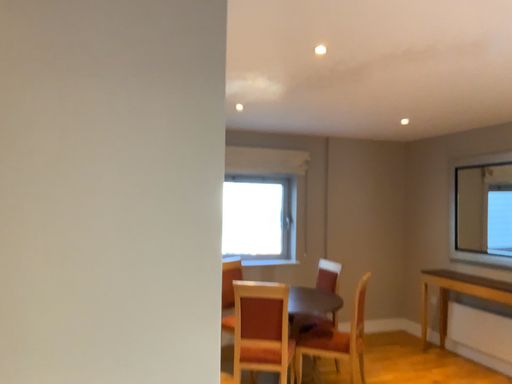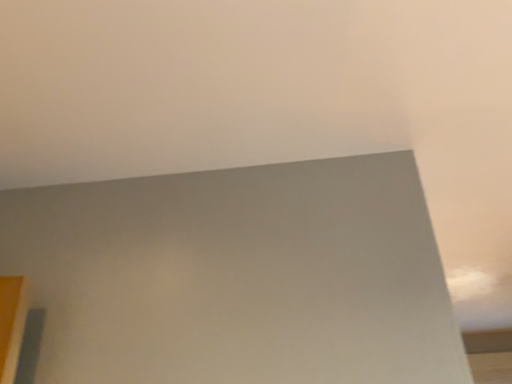
Question: Which way did the camera rotate in the video?

Choices:
 (A) rotated left
 (B) rotated right

Answer: (A)